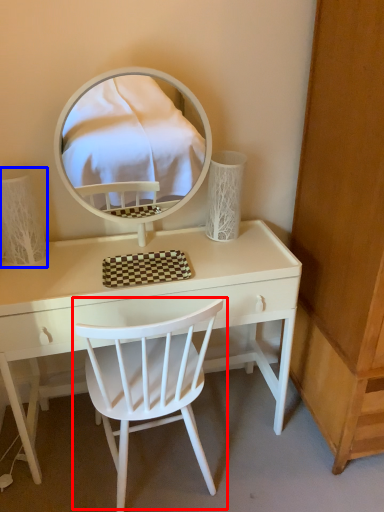
Question: Which object appears farthest to the camera in this image, chair (highlighted by a red box) or table lamp (highlighted by a blue box)?

Choices:
 (A) chair
 (B) table lamp

Answer: (B)